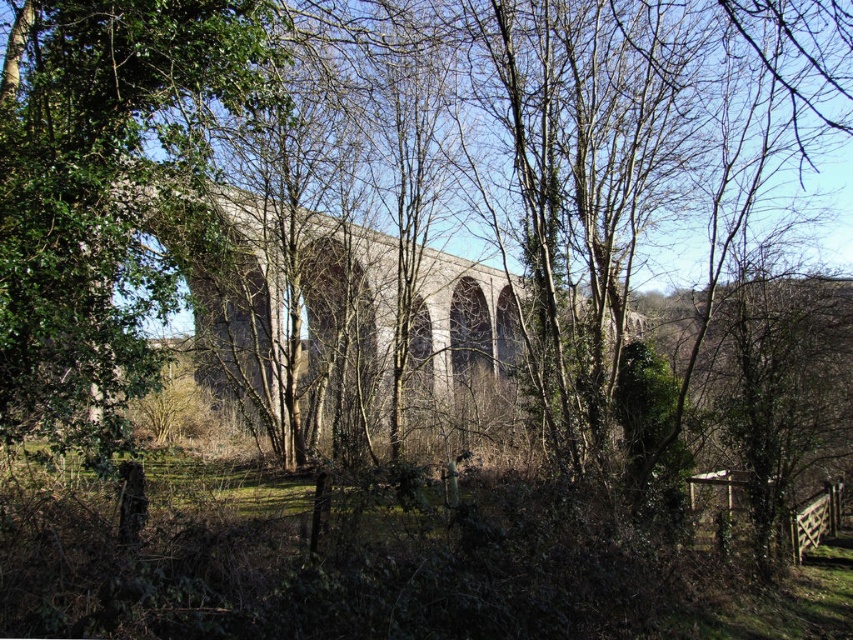
Question: Does green leafy tree at center come in front of concrete arches at center?

Choices:
 (A) no
 (B) yes

Answer: (B)

Question: From the image, what is the correct spatial relationship of green leafy tree at center in relation to concrete arches at center?

Choices:
 (A) right
 (B) left

Answer: (B)

Question: Is green leafy tree at center to the left of concrete arches at center from the viewer's perspective?

Choices:
 (A) yes
 (B) no

Answer: (A)

Question: Which of the following is the closest to the observer?

Choices:
 (A) concrete arches at center
 (B) green leafy tree at center

Answer: (B)